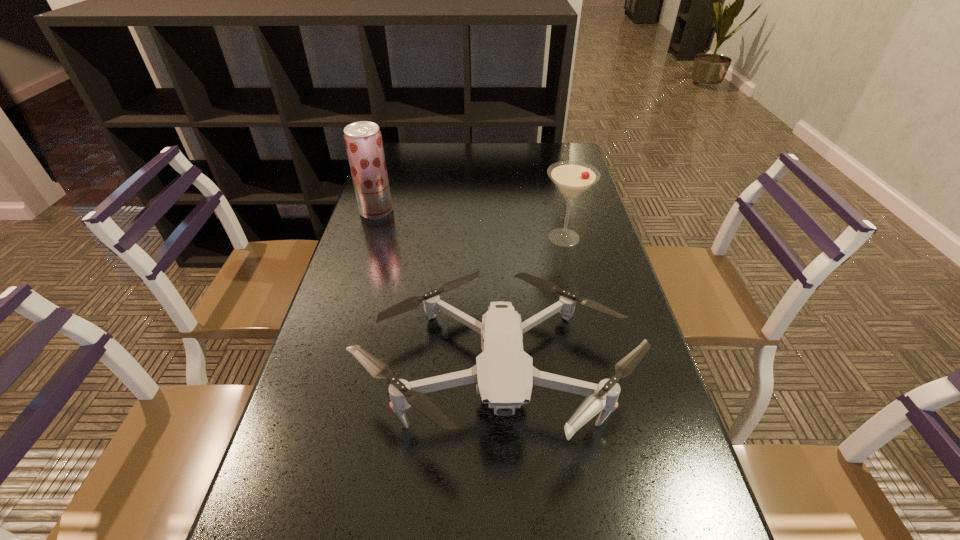
Identify the location of drone located in the left edge section of the desktop. (504, 373).

The image size is (960, 540). What are the coordinates of `martini present at the right edge` in the screenshot? It's located at (572, 178).

Identify the location of drone that is at the right edge. (504, 373).

This screenshot has width=960, height=540. In the image, there is a desktop. In order to click on blank space at the far edge in this screenshot , I will do `click(533, 155)`.

Where is `vacant space at the left edge of the desktop`? This screenshot has height=540, width=960. vacant space at the left edge of the desktop is located at coordinates (321, 400).

This screenshot has height=540, width=960. Find the location of `vacant space at the right edge of the desktop`. vacant space at the right edge of the desktop is located at coordinates (581, 305).

The image size is (960, 540). I want to click on free space at the far left corner of the desktop, so click(x=387, y=159).

Locate an element on the screen. This screenshot has height=540, width=960. free spot at the far right corner of the desktop is located at coordinates (549, 147).

Where is `free space between the drone and the second farthest object`? free space between the drone and the second farthest object is located at coordinates (530, 303).

What are the coordinates of `free space between the second tallest object and the fruit juice` in the screenshot? It's located at [470, 225].